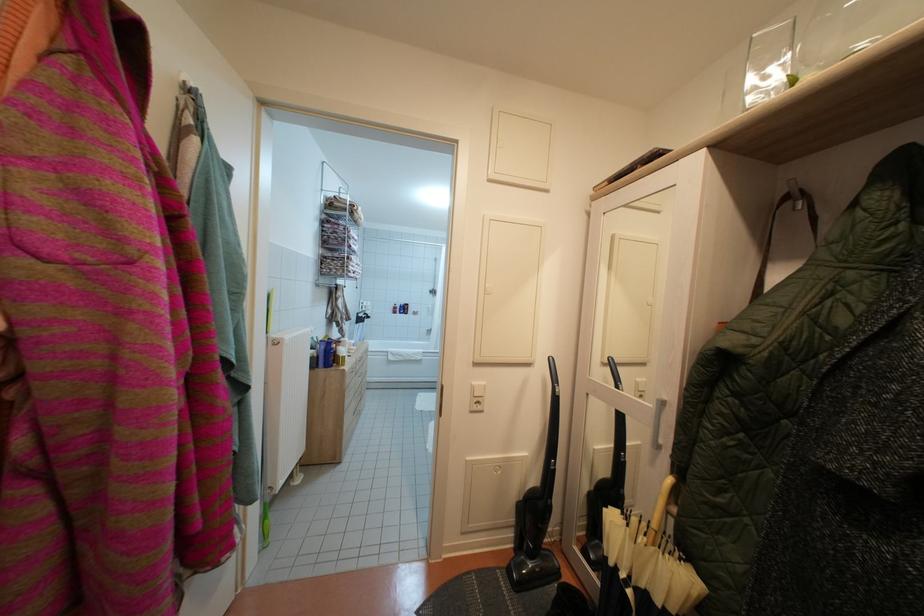
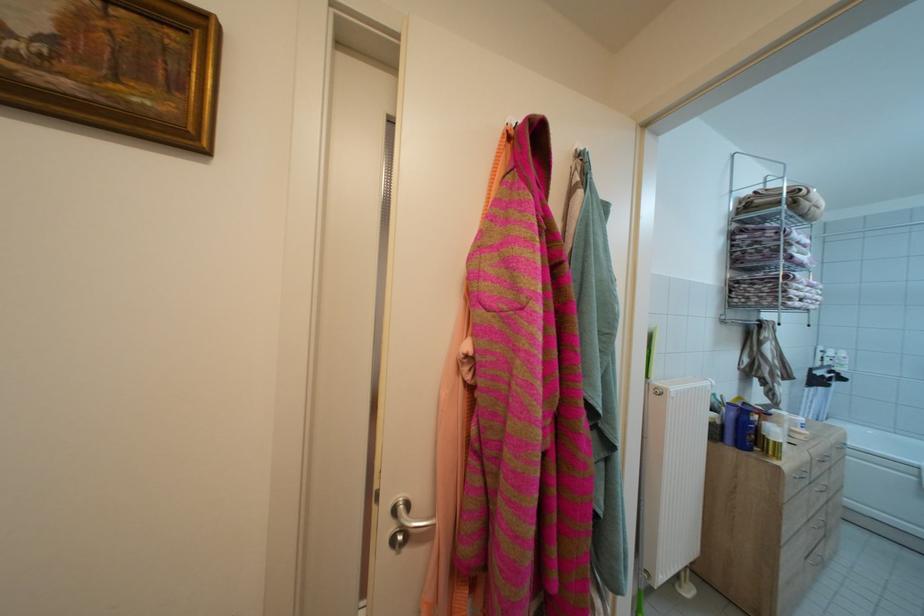
Locate, in the second image, the point that corresponds to [334,371] in the first image.

(748, 451)